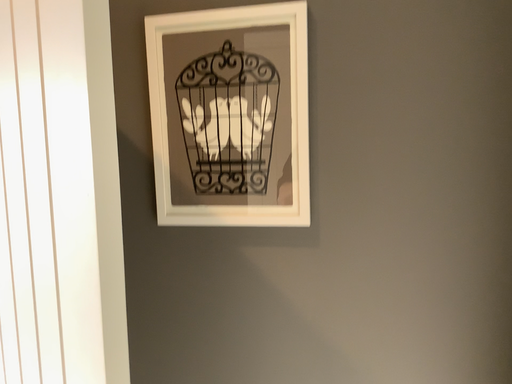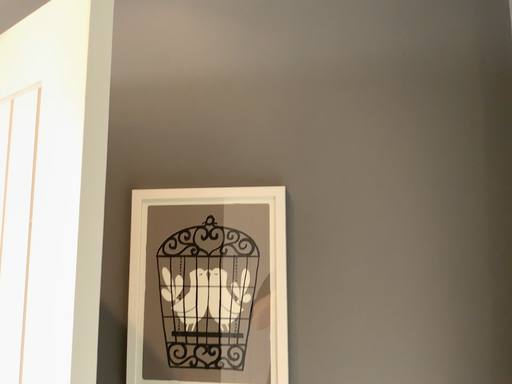
Question: Which way did the camera rotate in the video?

Choices:
 (A) rotated upward
 (B) rotated downward

Answer: (A)